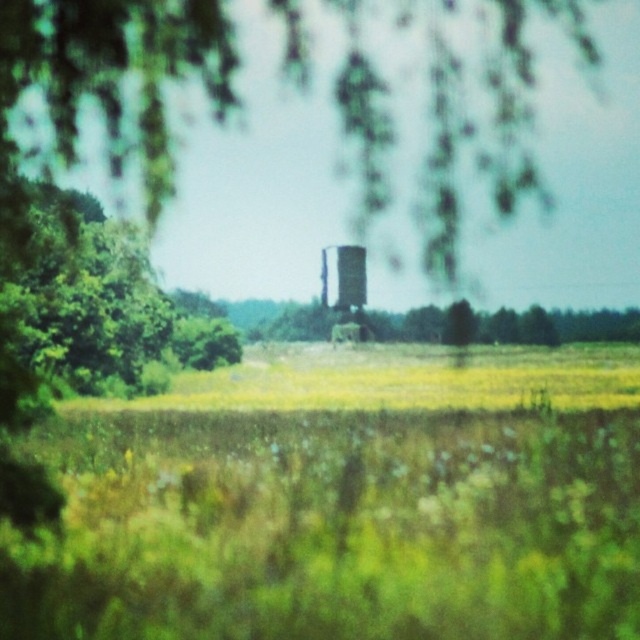
Question: Is green matte tree at center thinner than metallic silver water tower at center?

Choices:
 (A) yes
 (B) no

Answer: (B)

Question: Which object appears closest to the camera in this image?

Choices:
 (A) green leafy tree at left
 (B) metallic silver water tower at center

Answer: (A)

Question: Which point is farther to the camera?

Choices:
 (A) metallic silver water tower at center
 (B) green matte tree at center
 (C) green leafy tree at left

Answer: (B)

Question: Is green matte tree at center in front of metallic silver water tower at center?

Choices:
 (A) yes
 (B) no

Answer: (B)

Question: Which of these objects is positioned closest to the metallic silver water tower at center?

Choices:
 (A) green matte tree at center
 (B) green leafy tree at left

Answer: (A)

Question: Is green matte tree at center bigger than metallic silver water tower at center?

Choices:
 (A) no
 (B) yes

Answer: (B)